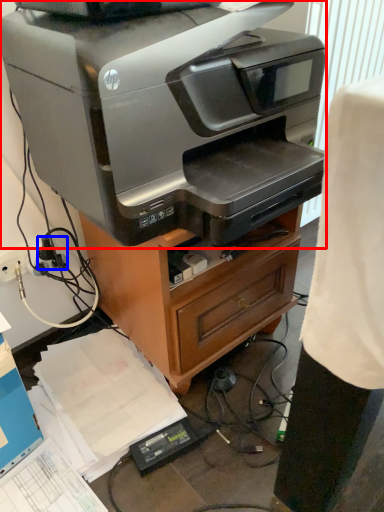
Question: Which of the following is the closest to the observer, printer (highlighted by a red box) or plug (highlighted by a blue box)?

Choices:
 (A) printer
 (B) plug

Answer: (A)